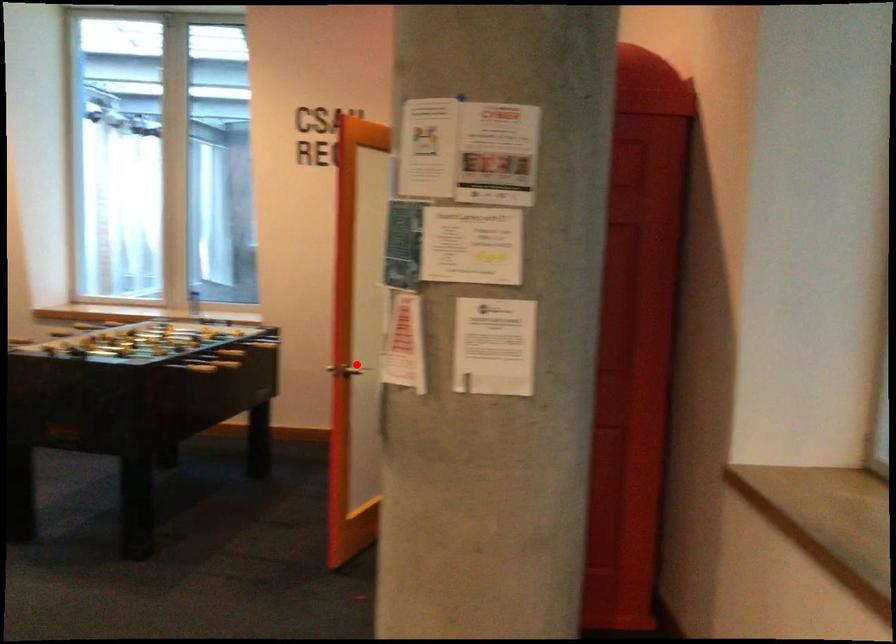
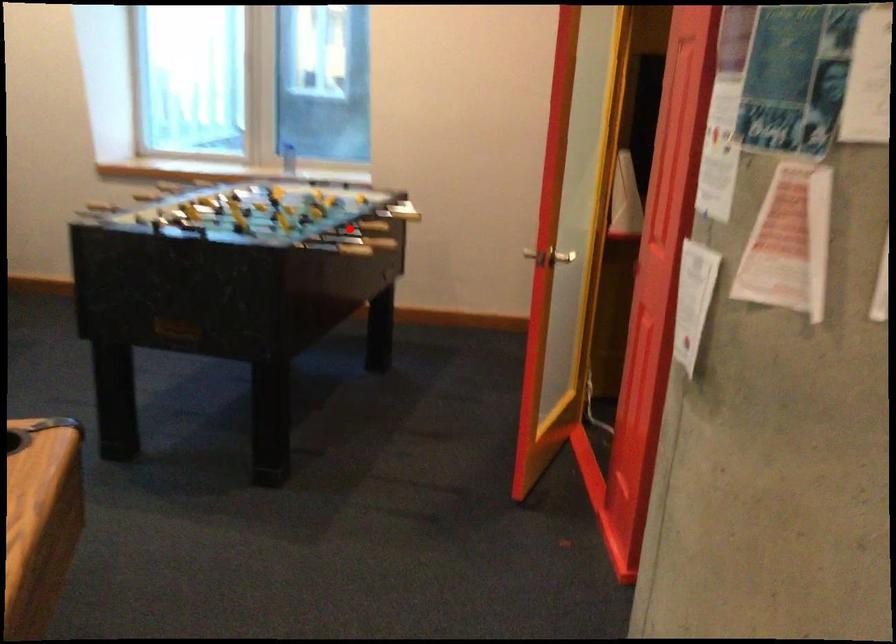
I am providing you with two images of the same scene from different viewpoints. A red point is marked on the first image and another point is marked on the second image. Is the red point in image1 aligned with the point shown in image2?

No